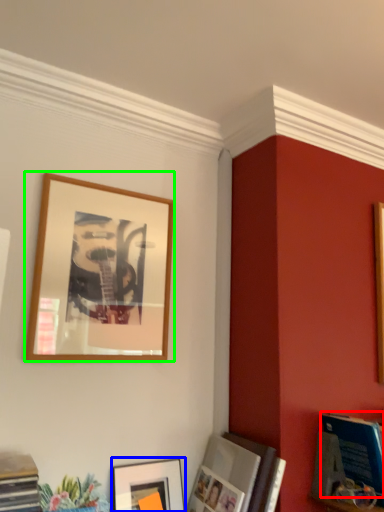
Question: Which is farther away from magazine (highlighted by a red box)? picture frame (highlighted by a blue box) or picture frame (highlighted by a green box)?

Choices:
 (A) picture frame
 (B) picture frame

Answer: (B)